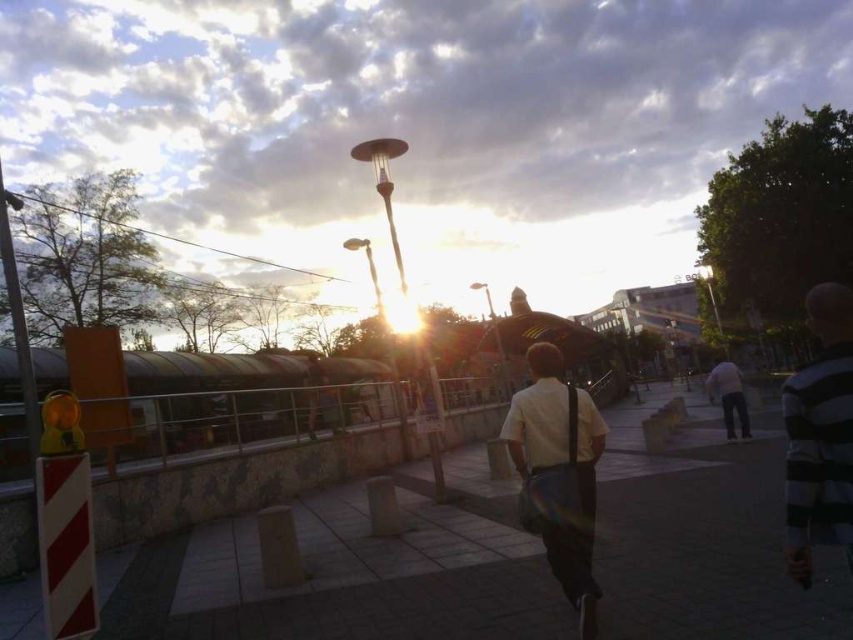
Does point (816, 356) come farther from viewer compared to point (732, 440)?

No, (816, 356) is closer to viewer.

In order to click on striped cotton shirt at right in this screenshot , I will do `click(820, 435)`.

Which of these two, white matte shirt at center or light gray jeans at center right, stands taller?

Standing taller between the two is light gray jeans at center right.

Who is positioned more to the left, white matte shirt at center or light gray jeans at center right?

From the viewer's perspective, white matte shirt at center appears more on the left side.

Locate an element on the screen. Image resolution: width=853 pixels, height=640 pixels. white matte shirt at center is located at coordinates (558, 474).

Locate an element on the screen. white matte shirt at center is located at coordinates (558, 474).

Does white matte shirt at center lie behind striped cotton shirt at right?

Yes, it is behind striped cotton shirt at right.

Between white matte shirt at center and striped cotton shirt at right, which one has less height?

With less height is white matte shirt at center.

Who is more distant from viewer, (585, 566) or (846, 518)?

The point (585, 566) is behind.

Where is `white matte shirt at center`? This screenshot has height=640, width=853. white matte shirt at center is located at coordinates (558, 474).